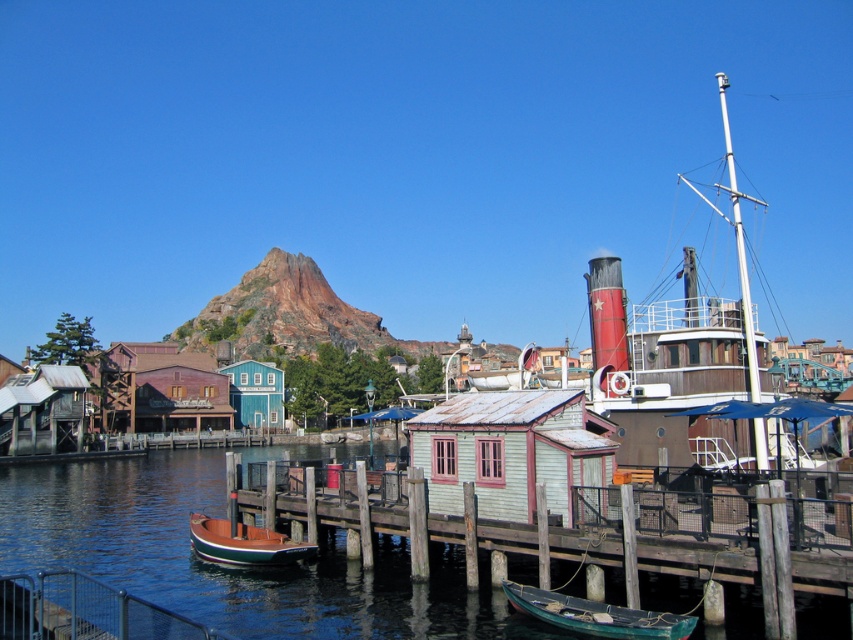
Question: Does blue water at dock center have a smaller size compared to teal wood cabin at center?

Choices:
 (A) yes
 (B) no

Answer: (B)

Question: Which object is the farthest from the teal wood cabin at center?

Choices:
 (A) blue water at dock center
 (B) wooden hut at center
 (C) green painted wood boat at lower center

Answer: (C)

Question: Which point is farther to the camera?

Choices:
 (A) (526, 426)
 (B) (560, 625)

Answer: (A)

Question: Considering the relative positions of light blue wooden hut at center and teal wood cabin at center in the image provided, where is light blue wooden hut at center located with respect to teal wood cabin at center?

Choices:
 (A) above
 (B) below

Answer: (A)

Question: Which point appears farthest from the camera in this image?

Choices:
 (A) (241, 387)
 (B) (489, 397)
 (C) (184, 396)
 (D) (27, 422)

Answer: (A)

Question: Can you confirm if blue water at dock center is positioned to the right of light blue wooden hut at center?

Choices:
 (A) no
 (B) yes

Answer: (A)